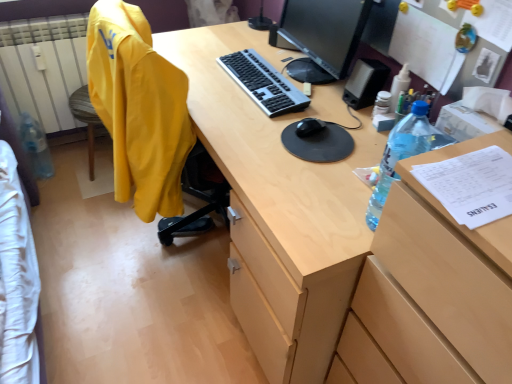
At what (x,y) coordinates should I click in order to perform the action: click on vacant area that is in front of black plastic speaker at upper right. Please return your answer as a coordinate pair (x, y). This screenshot has height=384, width=512. Looking at the image, I should click on (352, 120).